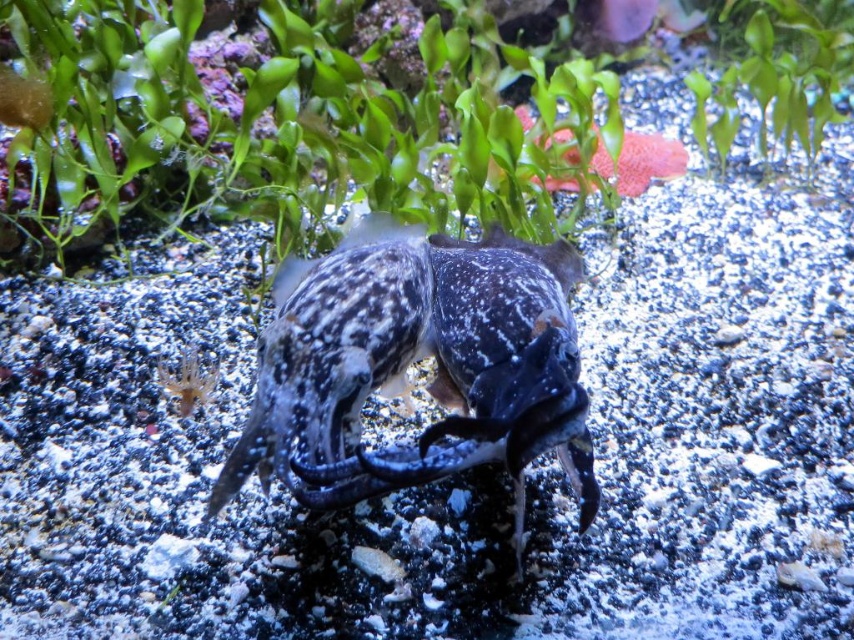
Question: Is speckled rubber fish at center behind smooth pink starfish at upper center?

Choices:
 (A) no
 (B) yes

Answer: (A)

Question: Which object is the closest to the smooth pink starfish at upper center?

Choices:
 (A) speckled rubber fish at center
 (B) green leafy plant at upper center
 (C) green leafy plant at upper right

Answer: (B)

Question: Can you confirm if green leafy plant at upper center is positioned above speckled rubber fish at center?

Choices:
 (A) no
 (B) yes

Answer: (B)

Question: Which point is closer to the camera?

Choices:
 (A) (539, 432)
 (B) (851, 4)

Answer: (A)

Question: Does speckled rubber fish at center appear under green leafy plant at upper right?

Choices:
 (A) no
 (B) yes

Answer: (B)

Question: Which point is closer to the camera?

Choices:
 (A) speckled rubber fish at center
 (B) smooth pink starfish at upper center
 (C) green leafy plant at upper right

Answer: (A)